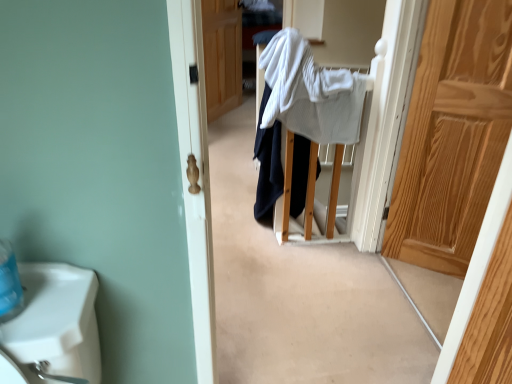
Question: Could you tell me if white textured bath towel at center is facing white cotton sweater at center?

Choices:
 (A) no
 (B) yes

Answer: (B)

Question: From a real-world perspective, is white textured bath towel at center on top of white cotton sweater at center?

Choices:
 (A) yes
 (B) no

Answer: (A)

Question: Can you confirm if white textured bath towel at center is wider than white cotton sweater at center?

Choices:
 (A) no
 (B) yes

Answer: (A)

Question: Considering the relative positions of white textured bath towel at center and white cotton sweater at center in the image provided, is white textured bath towel at center in front of white cotton sweater at center?

Choices:
 (A) no
 (B) yes

Answer: (B)

Question: Is white textured bath towel at center not inside white cotton sweater at center?

Choices:
 (A) no
 (B) yes

Answer: (B)

Question: Considering the positions of point (489, 18) and point (278, 157), is point (489, 18) closer or farther from the camera than point (278, 157)?

Choices:
 (A) farther
 (B) closer

Answer: (B)

Question: From the image's perspective, relative to white cotton sweater at center, is light brown wooden door at right, positioned as the 2th door in back-to-front order, above or below?

Choices:
 (A) above
 (B) below

Answer: (A)

Question: In terms of width, does light brown wooden door at right, which is the 2th door in top-to-bottom order, look wider or thinner when compared to white cotton sweater at center?

Choices:
 (A) thin
 (B) wide

Answer: (A)

Question: Considering the relative positions of light brown wooden door at right, which is the 2th door in top-to-bottom order, and white cotton sweater at center in the image provided, is light brown wooden door at right, which is the 2th door in top-to-bottom order, to the left or to the right of white cotton sweater at center?

Choices:
 (A) left
 (B) right

Answer: (B)

Question: From a real-world perspective, is white textured bath towel at center physically located above or below light brown wooden door at right, acting as the 2th door starting from the left?

Choices:
 (A) below
 (B) above

Answer: (B)

Question: From the image's perspective, relative to light brown wooden door at right, acting as the 2th door starting from the left, is white textured bath towel at center above or below?

Choices:
 (A) above
 (B) below

Answer: (A)

Question: Is point (296, 29) positioned closer to the camera than point (471, 182)?

Choices:
 (A) farther
 (B) closer

Answer: (A)

Question: In the image, is white textured bath towel at center positioned in front of or behind light brown wooden door at right, placed as the first door when sorted from right to left?

Choices:
 (A) behind
 (B) front

Answer: (A)

Question: In the image, is white textured bath towel at center positioned in front of or behind wooden door at center, the second door viewed from the right?

Choices:
 (A) behind
 (B) front

Answer: (B)

Question: Visually, is white textured bath towel at center positioned to the left or to the right of wooden door at center, which appears as the first door when viewed from the back?

Choices:
 (A) right
 (B) left

Answer: (A)